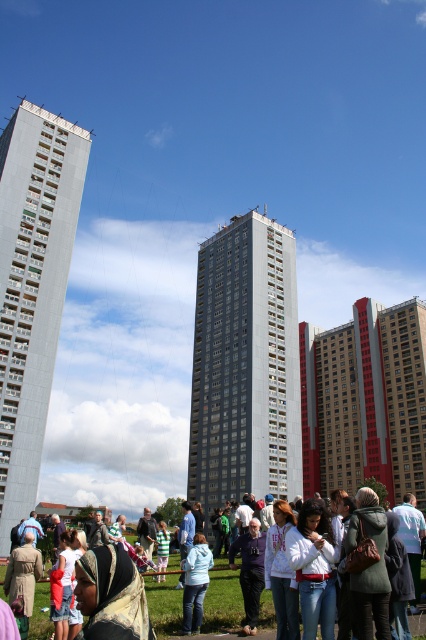
From the picture: You are standing at the origin point of the coordinate system. You want to walk to the white cotton shirt at center. What direction should you head towards?

Since the white cotton shirt at center is located at coordinate point 0.938 on the x axis and 0.523 on the y axis, you should head towards the northeast direction to reach it.

You are a drone operator trying to fly a drone from the gray concrete building at center to the light blue denim jacket at center. Based on their relative widths, which object is wider?

The gray concrete building at center is wider than the light blue denim jacket at center according to the description.

You are a photographer standing in the grassy area looking at the gray concrete building at left and the light blue denim jacket at center. Which object is higher in the scene?

The gray concrete building at left is above the light blue denim jacket at center, so it is higher in the scene.